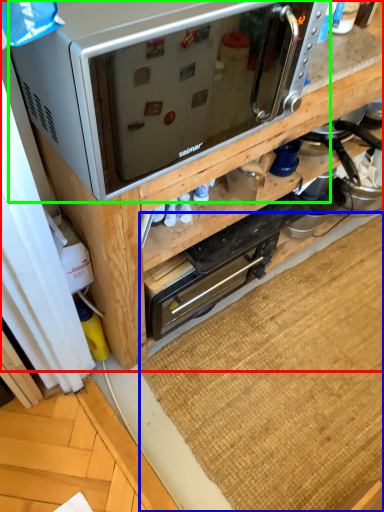
Question: Estimate the real-world distances between objects in this image. Which object is closer to cabinetry (highlighted by a red box), doormat (highlighted by a blue box) or microwave oven (highlighted by a green box)?

Choices:
 (A) doormat
 (B) microwave oven

Answer: (B)